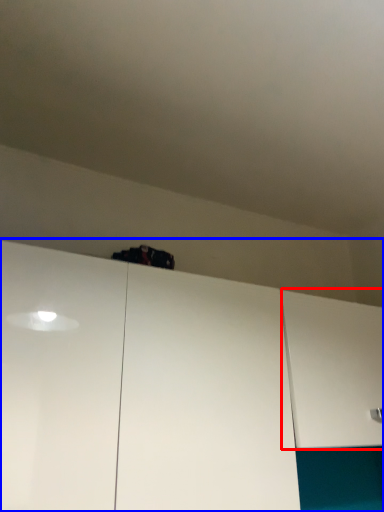
Question: Which of the following is the closest to the observer, cabinetry (highlighted by a red box) or cabinetry (highlighted by a blue box)?

Choices:
 (A) cabinetry
 (B) cabinetry

Answer: (B)